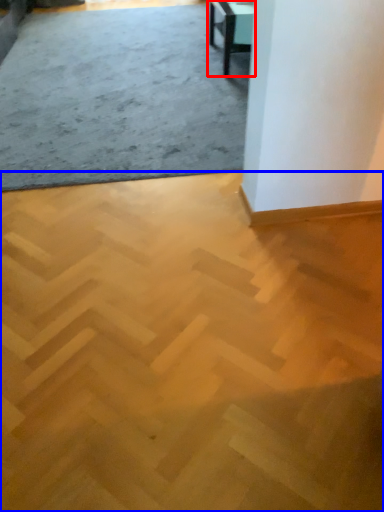
Question: Which object is closer to the camera taking this photo, table (highlighted by a red box) or concrete (highlighted by a blue box)?

Choices:
 (A) table
 (B) concrete

Answer: (B)